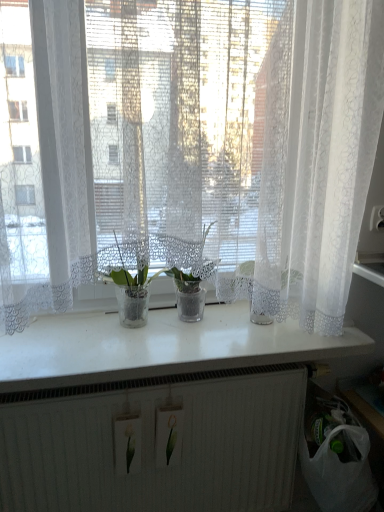
Identify the location of vacant area situated below clear glass vase at center, the 1th houseplant when ordered from left to right (from a real-world perspective). (134, 325).